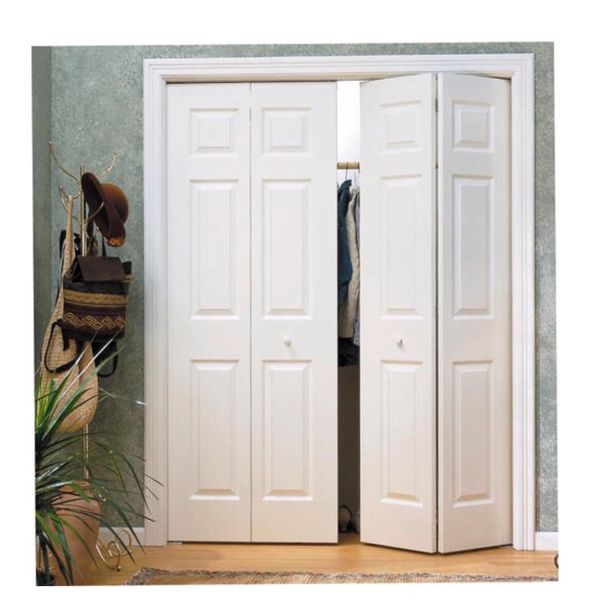
Where is `purse rack`? purse rack is located at coordinates (75, 420).